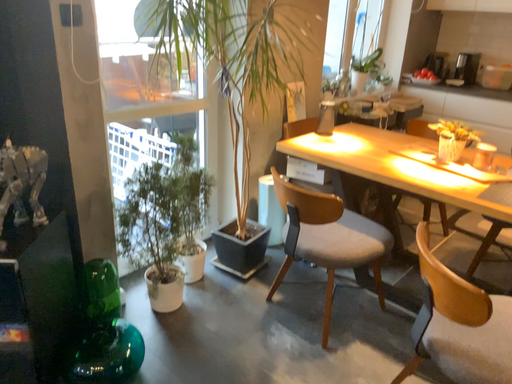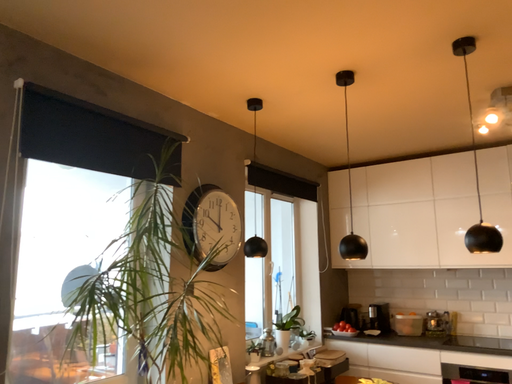
Question: Which way did the camera rotate in the video?

Choices:
 (A) rotated downward
 (B) rotated upward

Answer: (B)